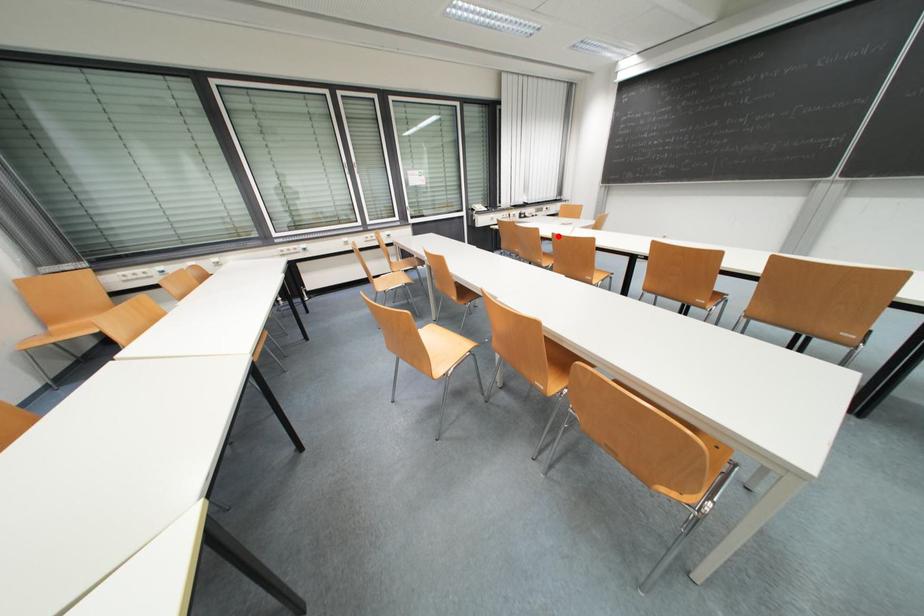
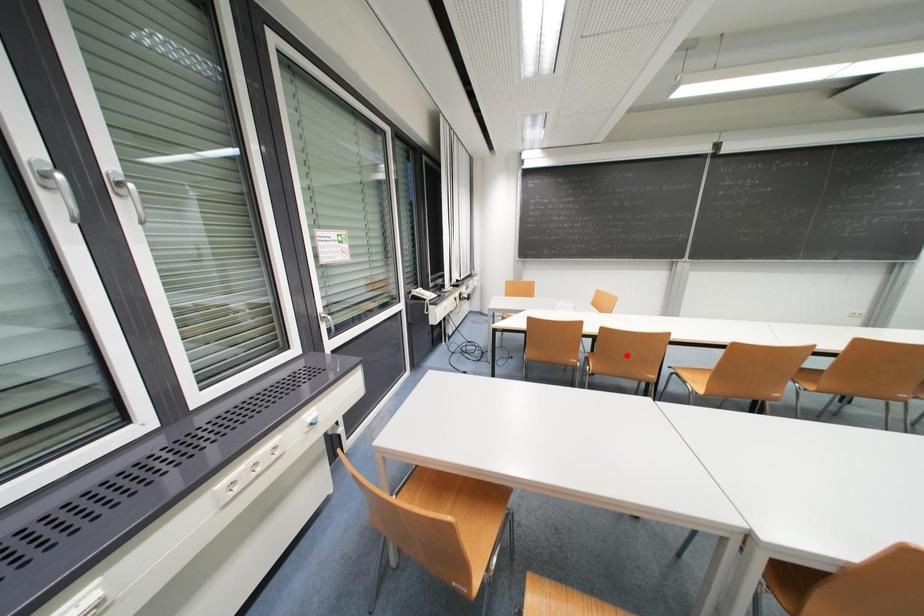
I am providing you with two images of the same scene from different viewpoints. A red point is marked on the first image and another point is marked on the second image. Is the marked point in image1 the same physical position as the marked point in image2?

No